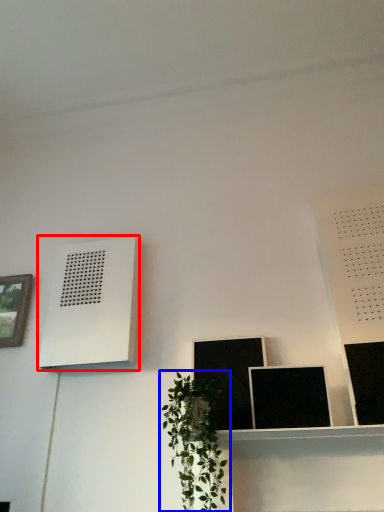
Question: Which of the following is the closest to the observer, air conditioner (highlighted by a red box) or houseplant (highlighted by a blue box)?

Choices:
 (A) air conditioner
 (B) houseplant

Answer: (B)